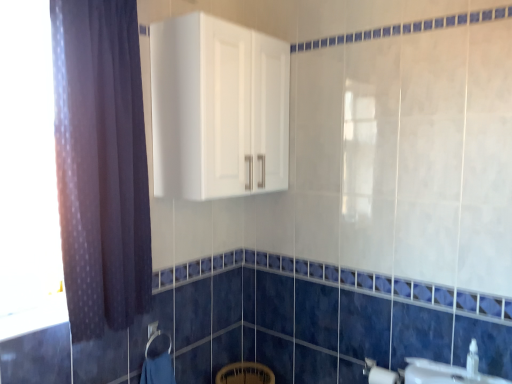
Question: From a real-world perspective, is dark purple fabric at left located higher than white glossy cabinet at upper center?

Choices:
 (A) yes
 (B) no

Answer: (B)

Question: From the image's perspective, does dark purple fabric at left appear lower than white glossy cabinet at upper center?

Choices:
 (A) no
 (B) yes

Answer: (B)

Question: Does dark purple fabric at left have a greater width compared to white glossy cabinet at upper center?

Choices:
 (A) no
 (B) yes

Answer: (A)

Question: Does dark purple fabric at left have a larger size compared to white glossy cabinet at upper center?

Choices:
 (A) yes
 (B) no

Answer: (B)

Question: Is the position of dark purple fabric at left less distant than that of white glossy cabinet at upper center?

Choices:
 (A) yes
 (B) no

Answer: (A)

Question: Is there a large distance between dark purple fabric at left and white glossy cabinet at upper center?

Choices:
 (A) yes
 (B) no

Answer: (B)

Question: Does white matte toilet paper at lower right have a smaller size compared to white glossy sink at lower right?

Choices:
 (A) no
 (B) yes

Answer: (A)

Question: From the image's perspective, does white matte toilet paper at lower right appear higher than white glossy sink at lower right?

Choices:
 (A) yes
 (B) no

Answer: (B)

Question: Can white glossy sink at lower right be found inside white matte toilet paper at lower right?

Choices:
 (A) no
 (B) yes

Answer: (A)

Question: From a real-world perspective, is white matte toilet paper at lower right positioned under white glossy sink at lower right based on gravity?

Choices:
 (A) no
 (B) yes

Answer: (B)

Question: Considering the relative sizes of white matte toilet paper at lower right and white glossy sink at lower right in the image provided, is white matte toilet paper at lower right shorter than white glossy sink at lower right?

Choices:
 (A) no
 (B) yes

Answer: (A)

Question: From the image's perspective, would you say white matte toilet paper at lower right is shown under white glossy sink at lower right?

Choices:
 (A) yes
 (B) no

Answer: (A)

Question: Is transparent glass window at left thinner than white glossy sink at lower right?

Choices:
 (A) no
 (B) yes

Answer: (A)